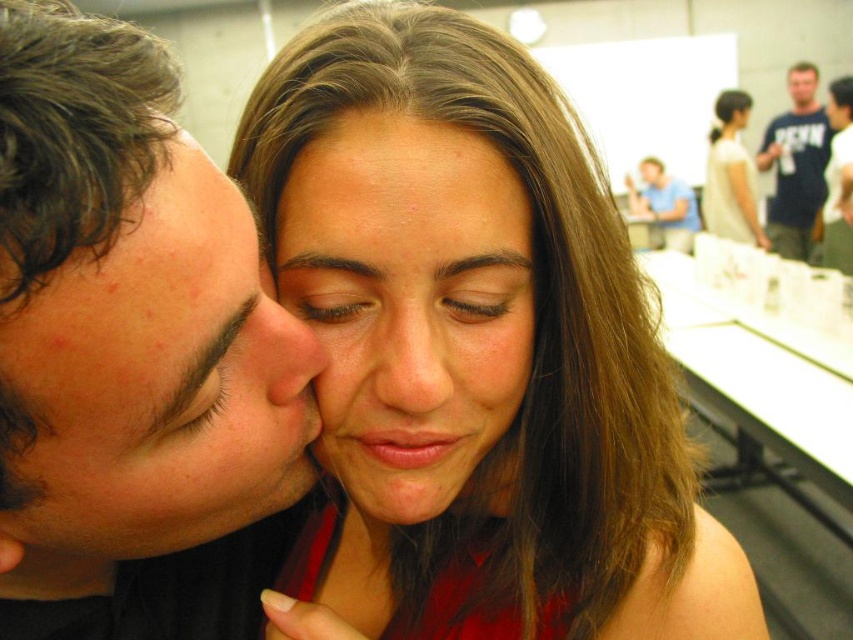
You are a photographer trying to capture the interaction between the two people in the scene. You want to ensure that both the smooth skin nose at center and the blue shirt at upper center are clearly visible in your photo. Given their sizes, which object should you focus on to ensure both are in frame?

The smooth skin nose at center occupies less space than the blue shirt at upper center, so you should focus on the blue shirt at upper center to ensure both are in frame since it is larger and easier to capture while still allowing the smaller nose to be visible.

Based on the scene description, what is the significance of the point at coordinates (408,304)?

The point at coordinates (408,304) corresponds to the smooth skin face at center, indicating the central focus of the image.